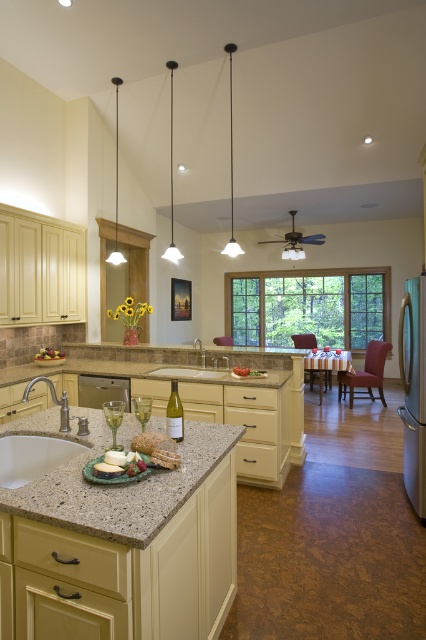
You are planning to install a new shelf in the kitchen that is 1.8 meters tall. Considering the height of the satin stainless steel refrigerator at right and the brown leather chair at center, which object would be more suitable to place the shelf above without blocking the kitchen counter?

The satin stainless steel refrigerator at right is taller than the brown leather chair at center. Since the shelf is 1.8 meters tall, placing it above the refrigerator would be more suitable as it can accommodate the height without blocking the kitchen counter.